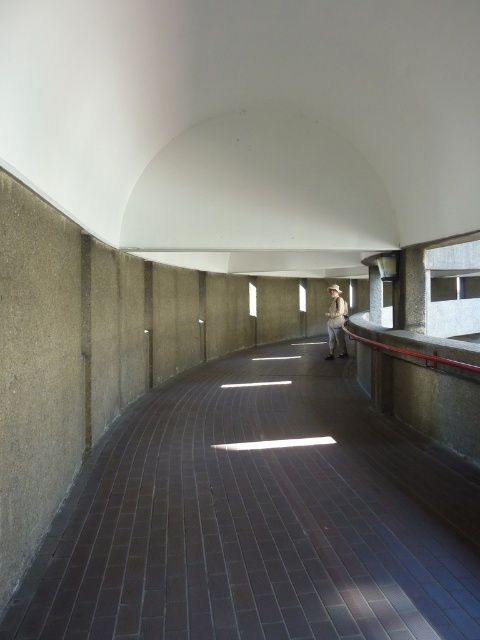
Question: Which point is closer to the camera?

Choices:
 (A) khaki fabric shirt at center
 (B) dark brick path at center

Answer: (B)

Question: Which of the following is the farthest from the observer?

Choices:
 (A) (338, 289)
 (B) (322, 548)

Answer: (A)

Question: Does dark brick path at center have a smaller size compared to khaki fabric shirt at center?

Choices:
 (A) no
 (B) yes

Answer: (B)

Question: Which object appears closest to the camera in this image?

Choices:
 (A) dark brick path at center
 (B) khaki fabric shirt at center

Answer: (A)

Question: Can you confirm if dark brick path at center is positioned to the left of khaki fabric shirt at center?

Choices:
 (A) no
 (B) yes

Answer: (B)

Question: Is dark brick path at center above khaki fabric shirt at center?

Choices:
 (A) no
 (B) yes

Answer: (A)